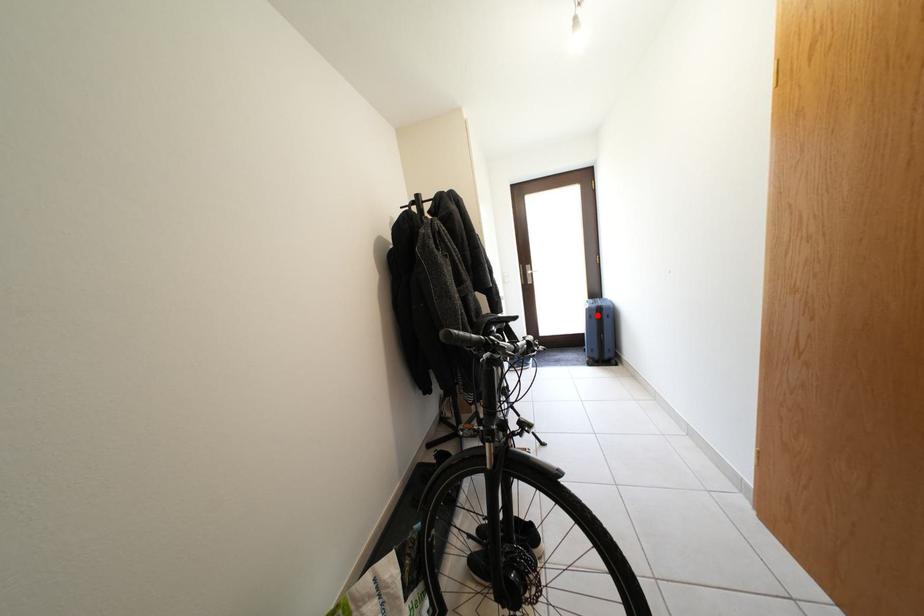
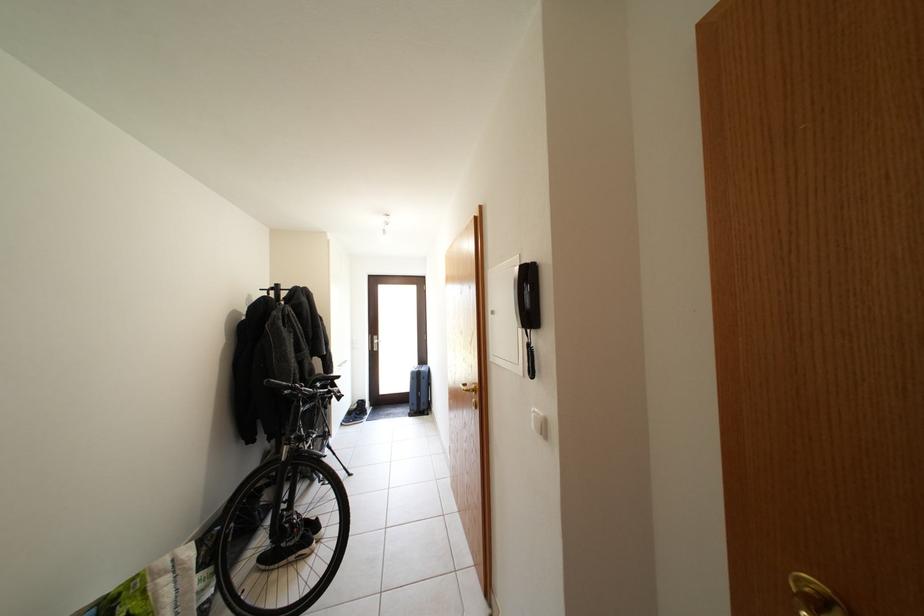
Question: I am providing you with two images of the same scene from different viewpoints. Image1 has a red point marked. In image2, the corresponding 3D location appears at what relative position? Reply with the corresponding letter.

Choices:
 (A) Closer
 (B) Farther

Answer: (B)